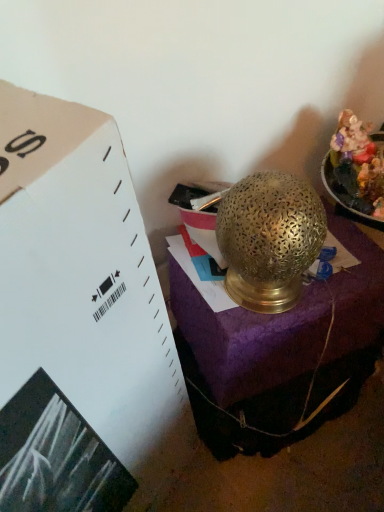
Question: Does gold textured lamp at center have a lesser height compared to shiny metallic food at upper right?

Choices:
 (A) no
 (B) yes

Answer: (A)

Question: Is gold textured lamp at center positioned behind shiny metallic food at upper right?

Choices:
 (A) no
 (B) yes

Answer: (B)

Question: Can you confirm if gold textured lamp at center is taller than shiny metallic food at upper right?

Choices:
 (A) yes
 (B) no

Answer: (A)

Question: Is gold textured lamp at center next to shiny metallic food at upper right?

Choices:
 (A) yes
 (B) no

Answer: (B)

Question: Considering the relative sizes of gold textured lamp at center and shiny metallic food at upper right in the image provided, is gold textured lamp at center bigger than shiny metallic food at upper right?

Choices:
 (A) yes
 (B) no

Answer: (A)

Question: Is shiny metallic food at upper right in front of or behind gold textured lamp at center in the image?

Choices:
 (A) behind
 (B) front

Answer: (B)

Question: Does point (360, 197) appear closer or farther from the camera than point (382, 265)?

Choices:
 (A) closer
 (B) farther

Answer: (A)

Question: Looking at the image, does shiny metallic food at upper right seem bigger or smaller compared to gold textured lamp at center?

Choices:
 (A) big
 (B) small

Answer: (B)

Question: Is shiny metallic food at upper right wider or thinner than gold textured lamp at center?

Choices:
 (A) wide
 (B) thin

Answer: (B)

Question: Is gold textured lamp at center to the left or to the right of shiny metallic food at upper right in the image?

Choices:
 (A) right
 (B) left

Answer: (B)

Question: Considering their positions, is gold textured lamp at center located in front of or behind shiny metallic food at upper right?

Choices:
 (A) behind
 (B) front

Answer: (A)

Question: Looking at their shapes, would you say gold textured lamp at center is wider or thinner than shiny metallic food at upper right?

Choices:
 (A) thin
 (B) wide

Answer: (A)

Question: Looking at the image, does gold textured lamp at center seem bigger or smaller compared to shiny metallic food at upper right?

Choices:
 (A) big
 (B) small

Answer: (A)

Question: Is point (345, 124) positioned closer to the camera than point (221, 261)?

Choices:
 (A) farther
 (B) closer

Answer: (B)

Question: From a real-world perspective, is shiny metallic food at upper right physically located above or below gold textured lamp at center?

Choices:
 (A) below
 (B) above

Answer: (B)